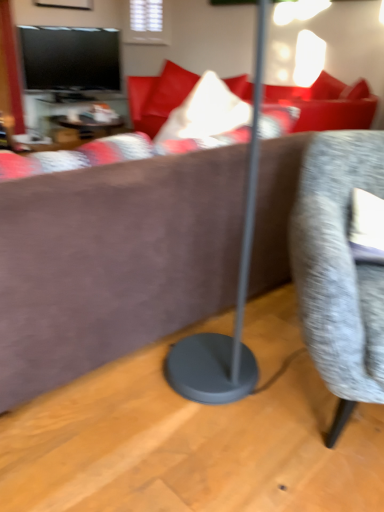
Question: Visually, is textured gray chair at right positioned to the left or to the right of wooden table at center?

Choices:
 (A) left
 (B) right

Answer: (B)

Question: Relative to wooden table at center, is textured gray chair at right in front or behind?

Choices:
 (A) front
 (B) behind

Answer: (A)

Question: Which of these objects is positioned farthest from the wooden table at center?

Choices:
 (A) brown suede couch at center
 (B) textured gray chair at right

Answer: (B)

Question: Which is farther from the brown suede couch at center?

Choices:
 (A) wooden table at center
 (B) textured gray chair at right

Answer: (A)